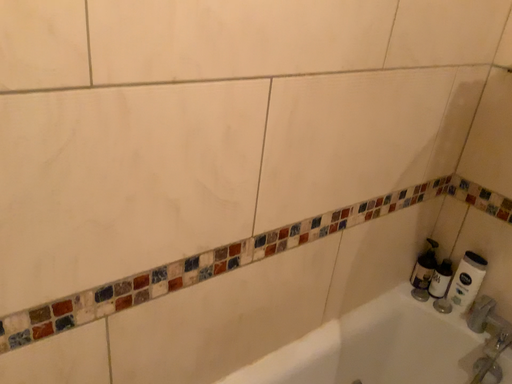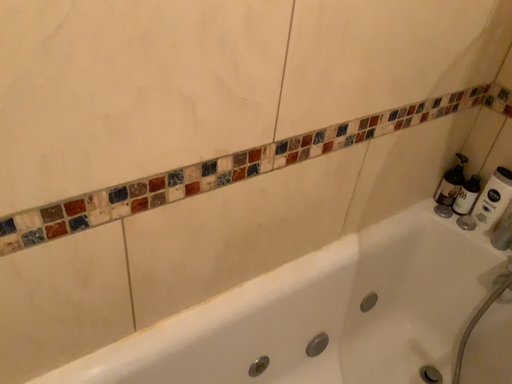
Question: Which way did the camera rotate in the video?

Choices:
 (A) rotated downward
 (B) rotated upward

Answer: (A)